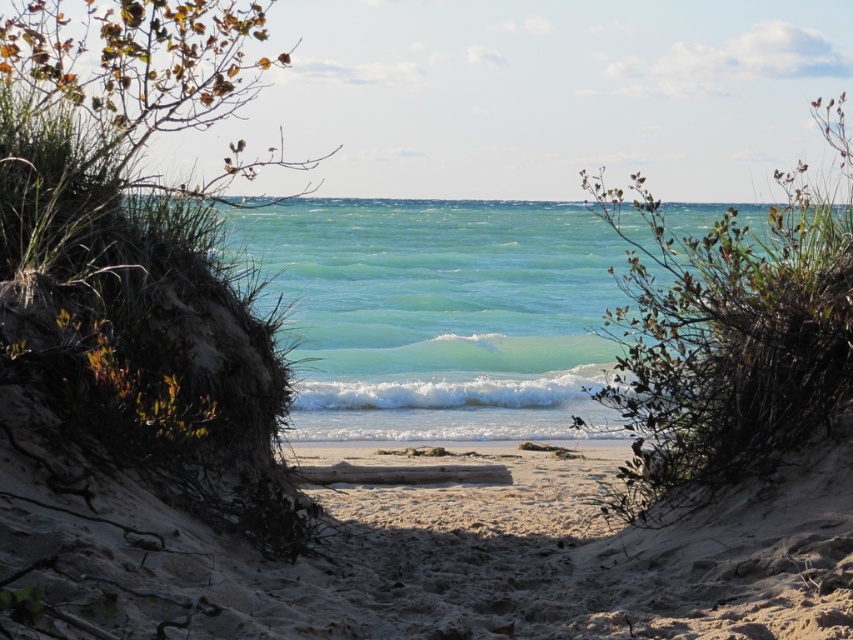
Is translucent teal water at center thinner than white sandy beach at center?

Incorrect, translucent teal water at center's width is not less than white sandy beach at center's.

Does point (457, 227) come behind point (456, 540)?

Yes, it is.

The image size is (853, 640). What are the coordinates of `translucent teal water at center` in the screenshot? It's located at (436, 314).